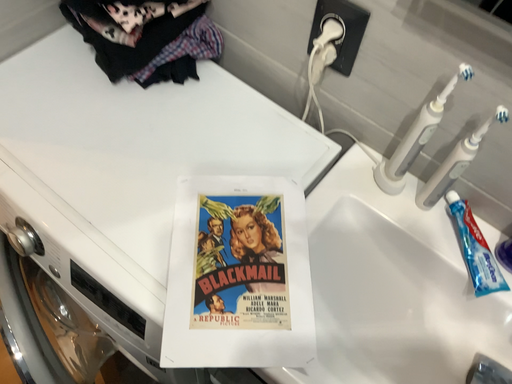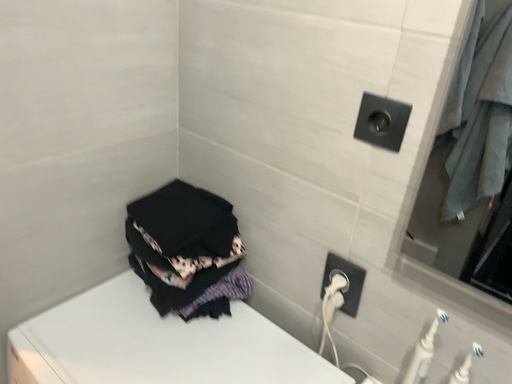
Question: Which way did the camera rotate in the video?

Choices:
 (A) rotated downward
 (B) rotated upward

Answer: (B)